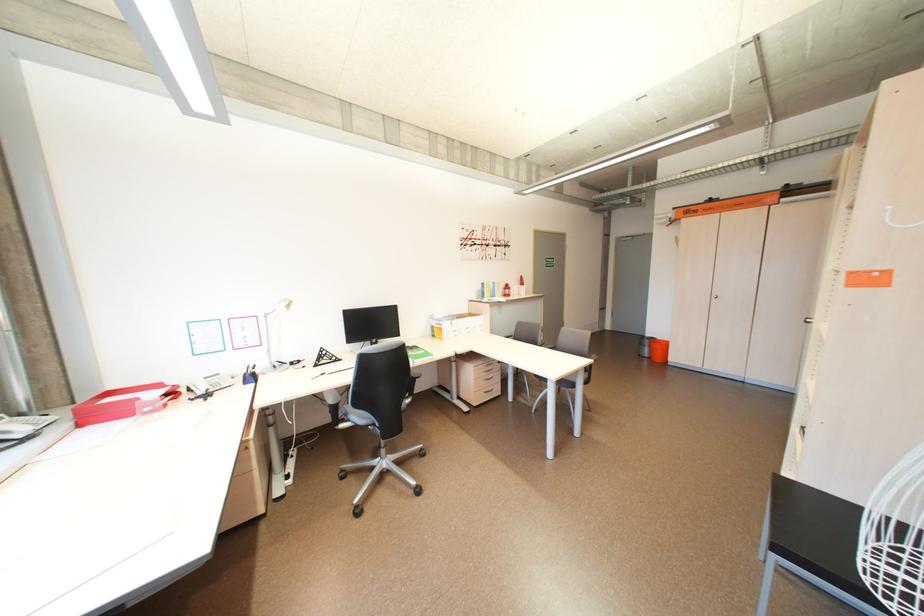
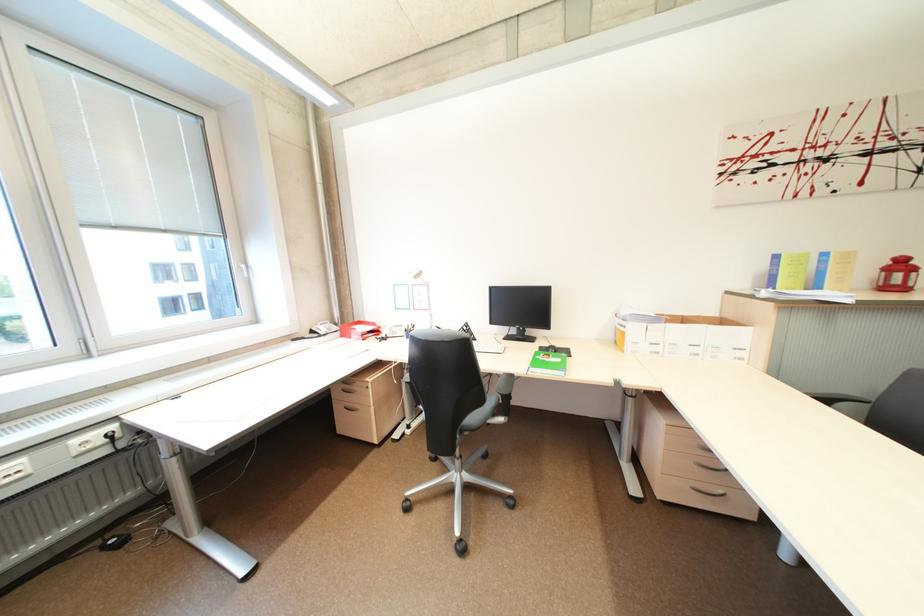
The point at (503, 297) is marked in the first image. Where is the corresponding point in the second image?

(825, 286)